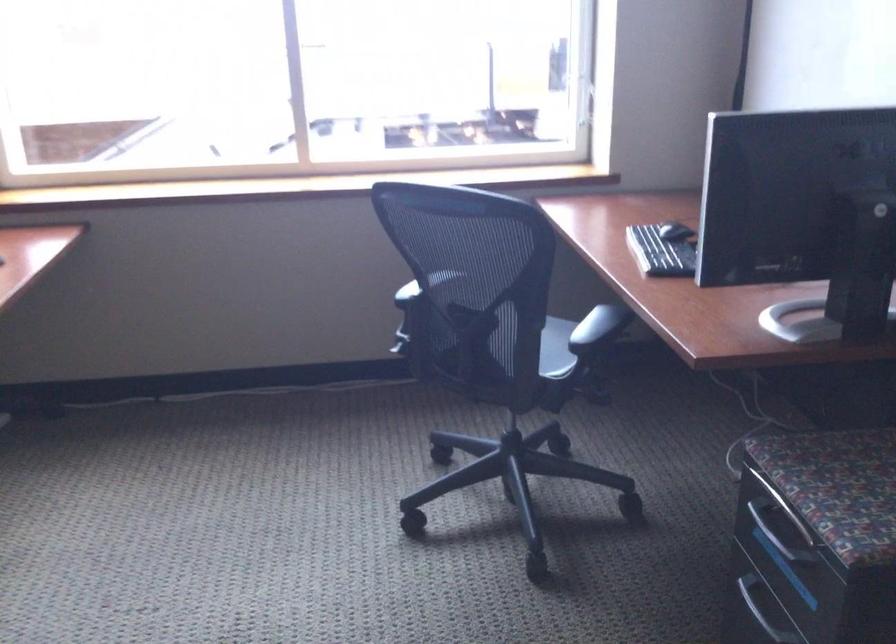
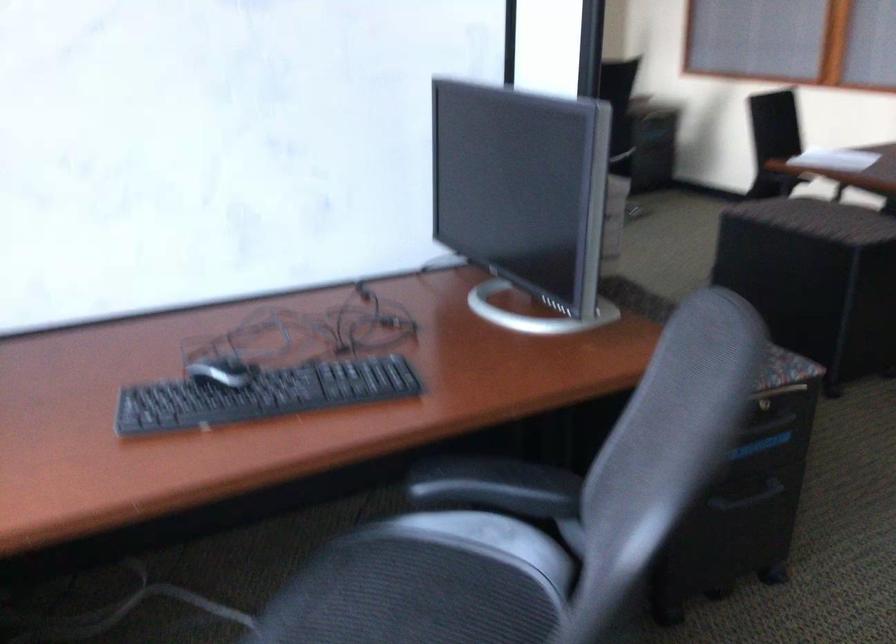
Where in the second image is the point corresponding to the point at 565,336 from the first image?

(410, 596)